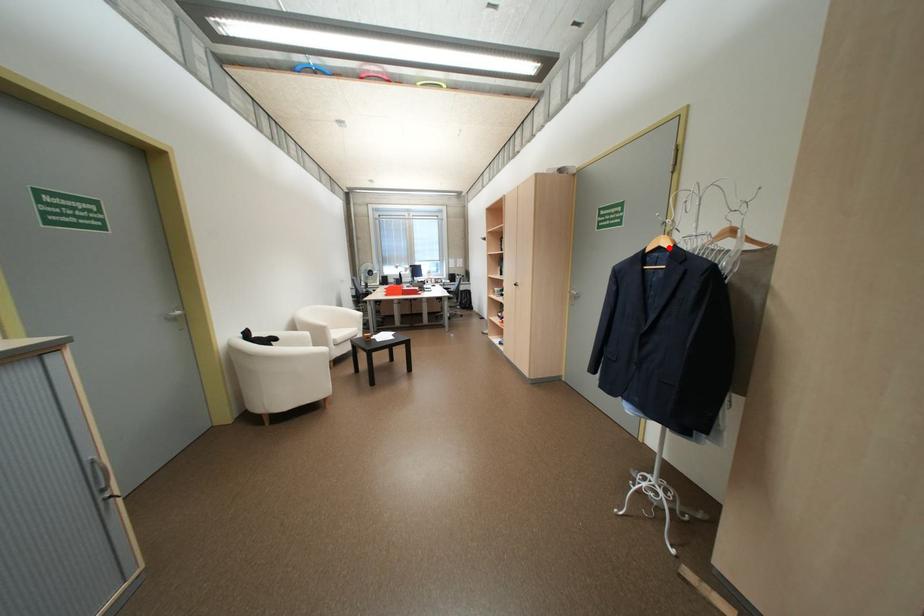
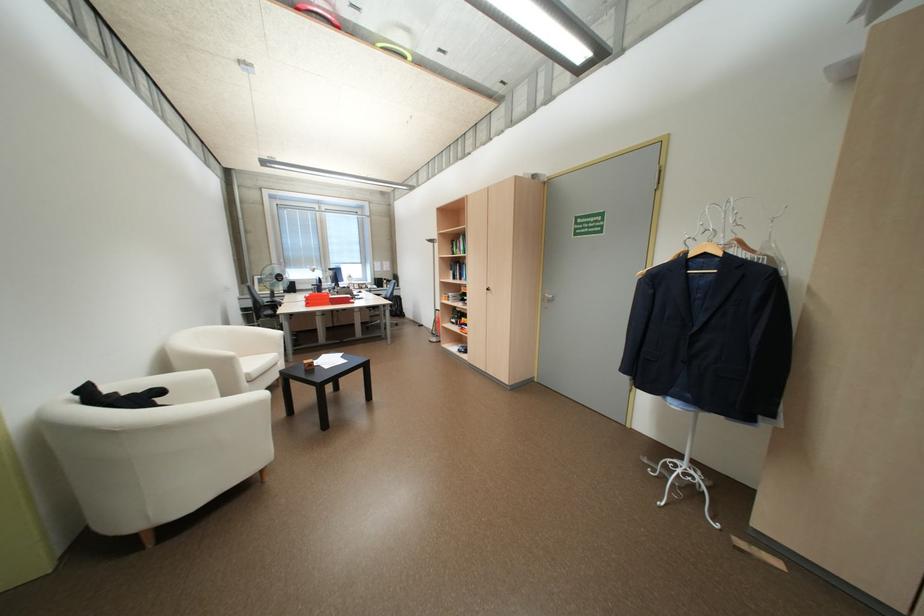
Locate, in the second image, the point that corresponds to the highlighted location in the first image.

(714, 254)